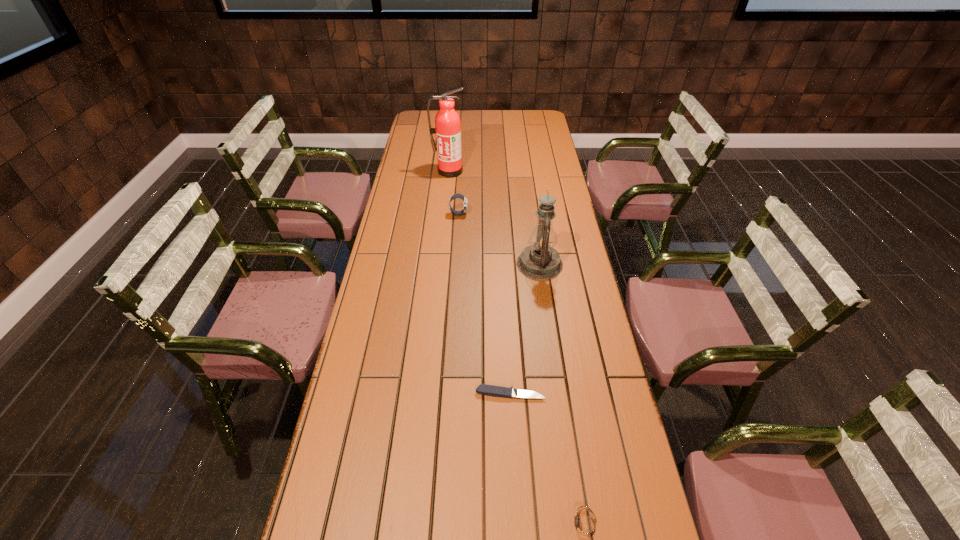
Identify the location of fire extinguisher. The width and height of the screenshot is (960, 540). (447, 128).

You are a GUI agent. You are given a task and a screenshot of the screen. Output one action in this format:
    pyautogui.click(x=<x>, y=<y>)
    Task: Click on the tallest object
    The image size is (960, 540).
    Given the screenshot: What is the action you would take?
    pyautogui.click(x=447, y=128)

This screenshot has height=540, width=960. I want to click on the second tallest object, so click(540, 261).

I want to click on oil lamp, so click(540, 261).

Image resolution: width=960 pixels, height=540 pixels. What are the coordinates of `the second farthest object` in the screenshot? It's located at (465, 201).

You are a GUI agent. You are given a task and a screenshot of the screen. Output one action in this format:
    pyautogui.click(x=<x>, y=<y>)
    Task: Click on the farther watch
    The image size is (960, 540).
    Given the screenshot: What is the action you would take?
    pyautogui.click(x=465, y=201)

Find the location of a particular element. the shortest object is located at coordinates (496, 391).

Where is `the second nearest object`? Image resolution: width=960 pixels, height=540 pixels. the second nearest object is located at coordinates (496, 391).

At what (x,y) coordinates should I click in order to perform the action: click on blank space located on the label side of the tallest object. Please return your answer as a coordinate pair (x, y). This screenshot has width=960, height=540. Looking at the image, I should click on (446, 201).

Where is `vacant space positioned 0.060m on the right of the third nearest object`? The height and width of the screenshot is (540, 960). vacant space positioned 0.060m on the right of the third nearest object is located at coordinates (580, 264).